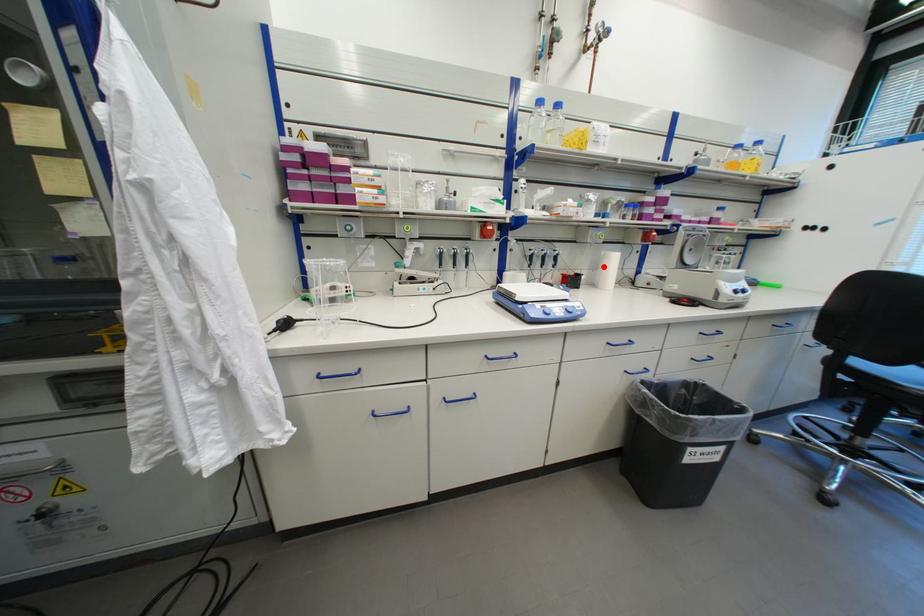
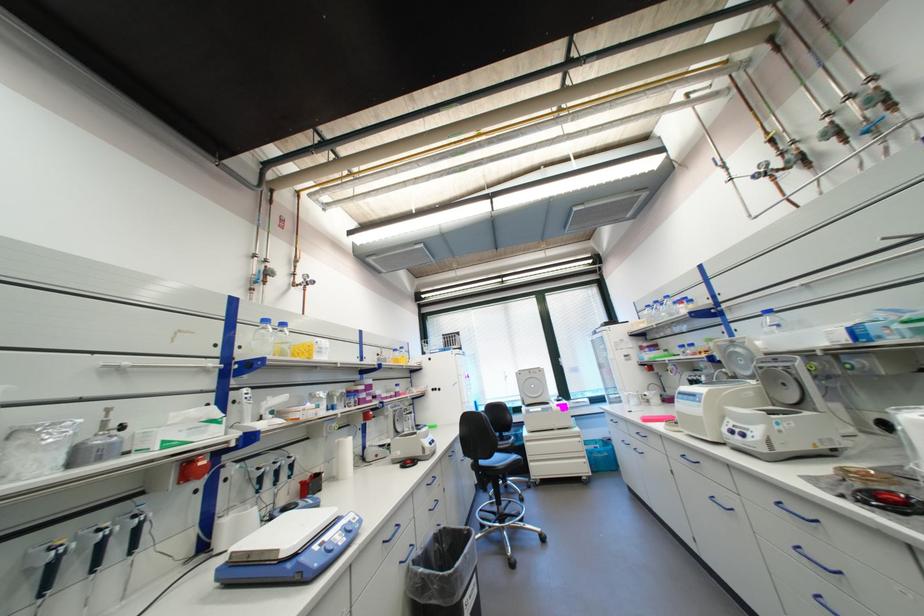
Question: I am providing you with two images of the same scene from different viewpoints. A red point is shown in image1. For the corresponding object point in image2, is it positioned nearer or farther from the camera?

Choices:
 (A) Nearer
 (B) Farther

Answer: (B)